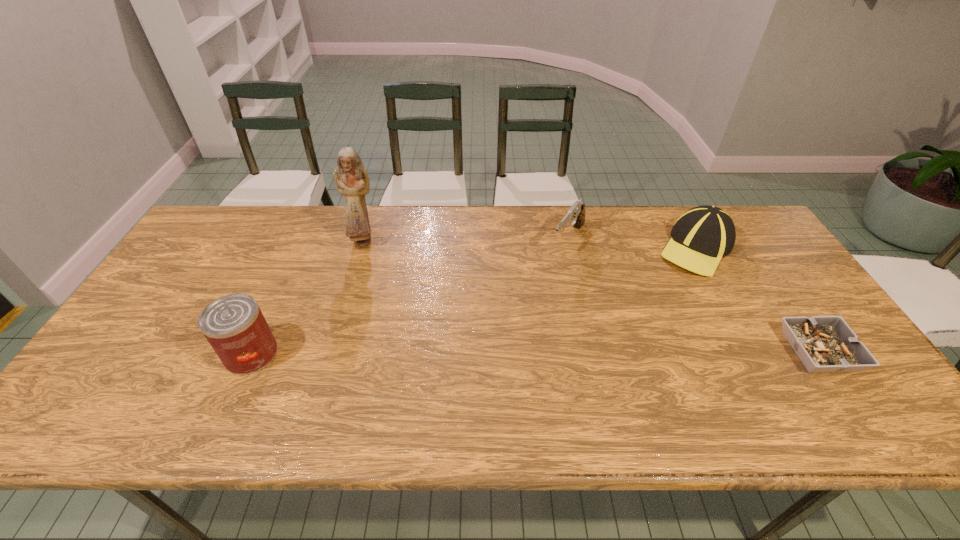
At what (x,y) coordinates should I click in order to perform the action: click on vacant space positioned 0.130m at the muzzle of the third object from right to left. Please return your answer as a coordinate pair (x, y). The width and height of the screenshot is (960, 540). Looking at the image, I should click on (543, 285).

Locate an element on the screen. free space located on the front-facing side of the figurine is located at coordinates click(x=398, y=284).

The height and width of the screenshot is (540, 960). Find the location of `vacant area situated on the front-facing side of the figurine`. vacant area situated on the front-facing side of the figurine is located at coordinates (434, 325).

You are a GUI agent. You are given a task and a screenshot of the screen. Output one action in this format:
    pyautogui.click(x=<x>, y=<y>)
    Task: Click on the vacant region located 0.310m on the front-facing side of the figurine
    The height and width of the screenshot is (540, 960).
    Given the screenshot: What is the action you would take?
    pyautogui.click(x=422, y=312)

Locate an element on the screen. The width and height of the screenshot is (960, 540). free location located 0.140m with the brim of the baseball cap facing forward is located at coordinates (649, 289).

Find the location of a particular element. vacant point located with the brim of the baseball cap facing forward is located at coordinates (662, 278).

Where is `free space located with the brim of the baseball cap facing forward`? The image size is (960, 540). free space located with the brim of the baseball cap facing forward is located at coordinates (636, 300).

The width and height of the screenshot is (960, 540). I want to click on gun at the far edge, so click(x=575, y=217).

At what (x,y) coordinates should I click in order to perform the action: click on figurine positioned at the far edge. Please return your answer as a coordinate pair (x, y). The width and height of the screenshot is (960, 540). Looking at the image, I should click on (351, 177).

This screenshot has height=540, width=960. Identify the location of baseball cap that is at the far edge. (703, 235).